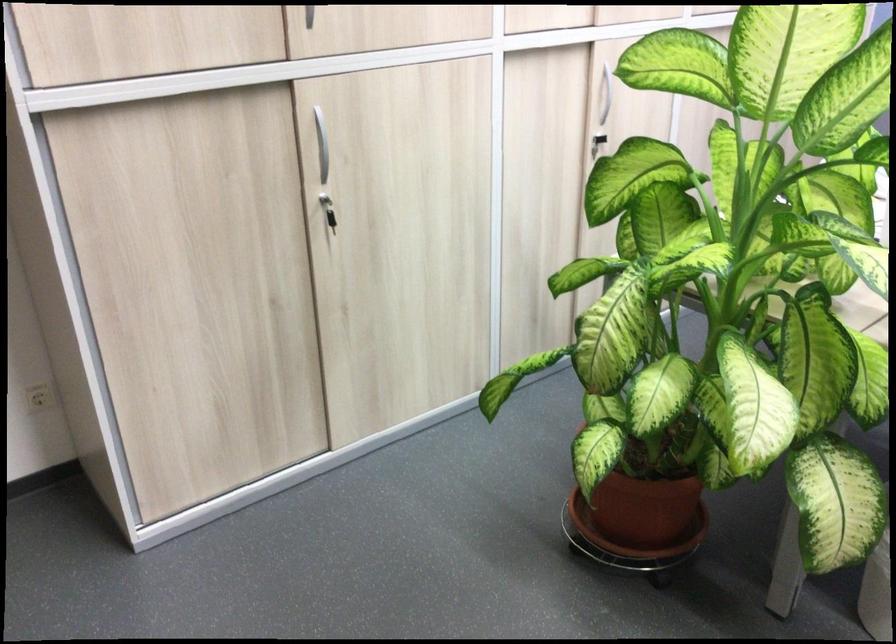
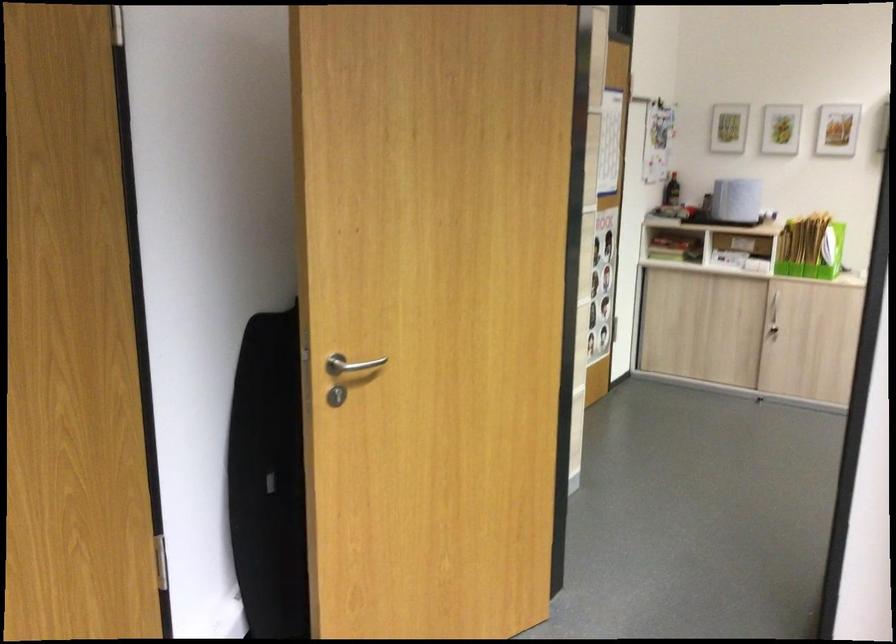
Question: How did the camera likely rotate?

Choices:
 (A) Left
 (B) Right
 (C) Up
 (D) Down

Answer: (A)